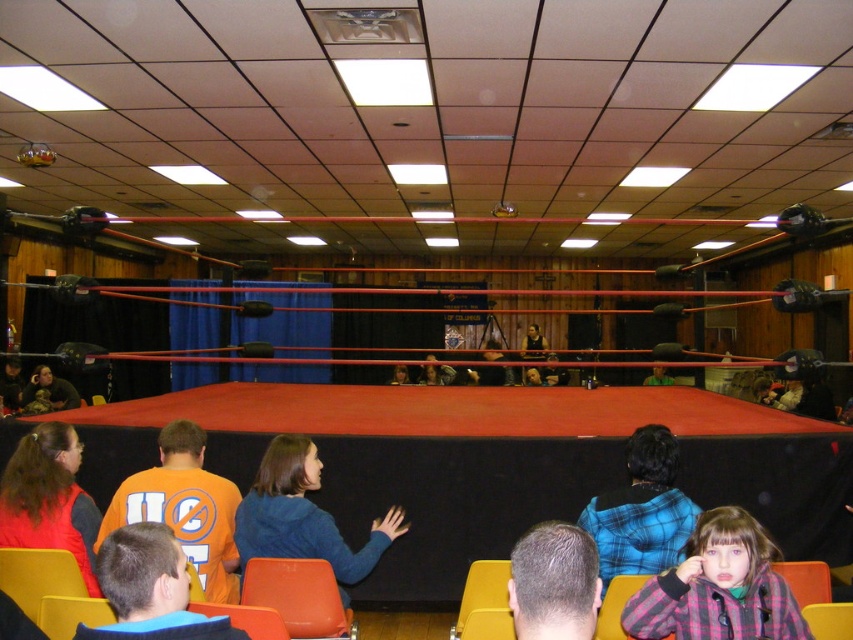
Question: Estimate the real-world distances between objects in this image. Which object is closer to the plaid flannel shirt at lower right?

Choices:
 (A) matte black jacket at lower left
 (B) orange plastic chair at lower center

Answer: (B)

Question: Is plaid flannel shirt at lower right smaller than matte black jacket at lower left?

Choices:
 (A) yes
 (B) no

Answer: (A)

Question: Is plaid flannel shirt at lower right bigger than matte black jacket at lower left?

Choices:
 (A) yes
 (B) no

Answer: (B)

Question: Which point is farther from the camera taking this photo?

Choices:
 (A) (666, 576)
 (B) (53, 376)
 (C) (314, 600)

Answer: (B)

Question: Can you confirm if orange plastic chair at lower center is positioned to the right of matte black jacket at lower left?

Choices:
 (A) yes
 (B) no

Answer: (A)

Question: Which object is the closest to the matte black jacket at lower left?

Choices:
 (A) orange plastic chair at lower center
 (B) plaid flannel shirt at lower right

Answer: (A)